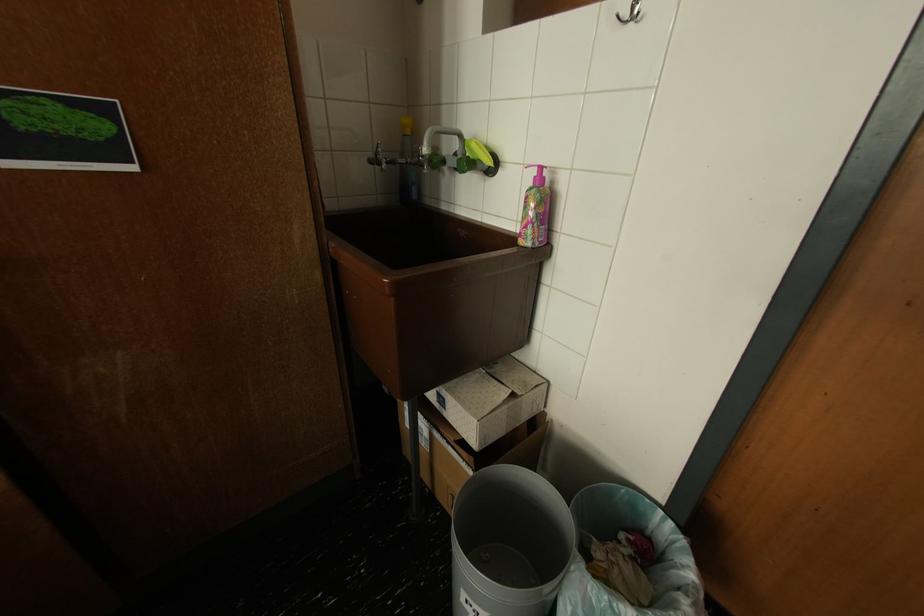
You are a GUI agent. You are given a task and a screenshot of the screen. Output one action in this format:
    pyautogui.click(x=<x>, y=<y>)
    Task: Click on the pink dispenser pump
    
    Given the screenshot: What is the action you would take?
    pyautogui.click(x=538, y=175)